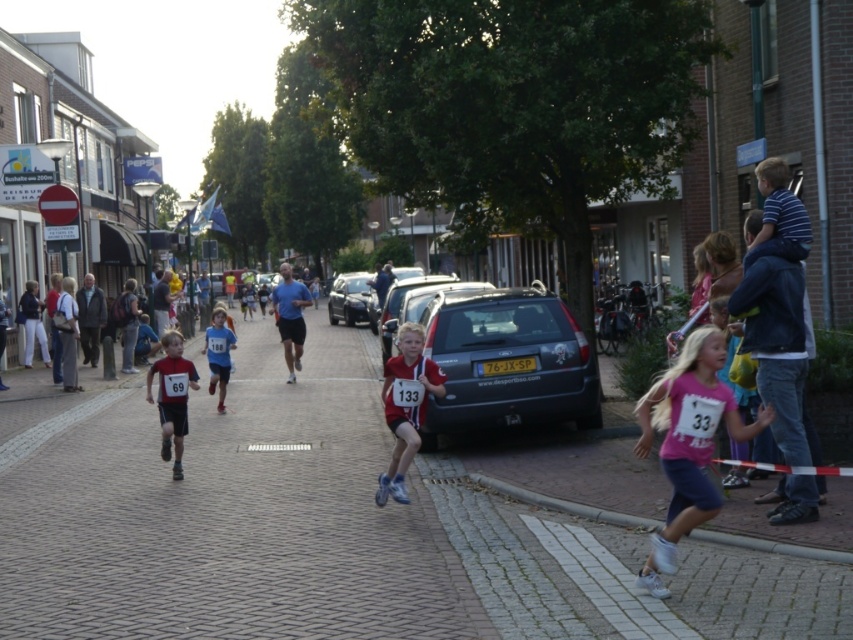
Question: Is the position of pink fabric shirt at center less distant than that of blue jersey at center?

Choices:
 (A) no
 (B) yes

Answer: (B)

Question: Among these points, which one is farthest from the camera?

Choices:
 (A) (717, 369)
 (B) (223, 328)
 (C) (178, 380)
 (D) (396, 472)

Answer: (B)

Question: Among these points, which one is farthest from the camera?

Choices:
 (A) click(x=407, y=416)
 (B) click(x=206, y=330)

Answer: (B)

Question: Does pink fabric shirt at center appear on the left side of matte black shorts at left?

Choices:
 (A) yes
 (B) no

Answer: (B)

Question: Which point appears closest to the camera in this image?

Choices:
 (A) (206, 346)
 (B) (177, 410)
 (C) (717, 401)
 (D) (416, 387)

Answer: (C)

Question: Does red matte shirt at center have a larger size compared to matte black shorts at left?

Choices:
 (A) no
 (B) yes

Answer: (A)